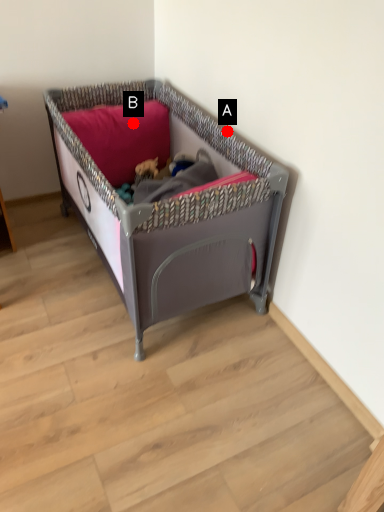
Question: Two points are circled on the image, labeled by A and B beside each circle. Among these points, which one is farthest from the camera?

Choices:
 (A) A is further
 (B) B is further

Answer: (B)